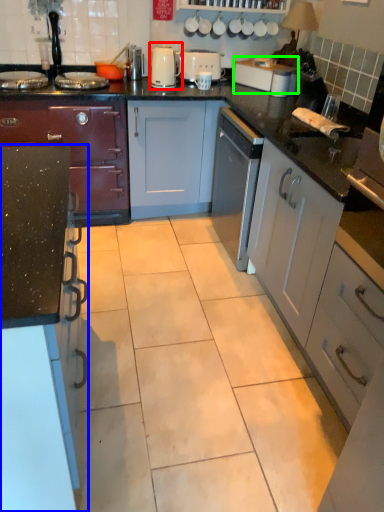
Question: Estimate the real-world distances between objects in this image. Which object is farther from kitchen appliance (highlighted by a red box), cabinetry (highlighted by a blue box) or toaster (highlighted by a green box)?

Choices:
 (A) cabinetry
 (B) toaster

Answer: (A)